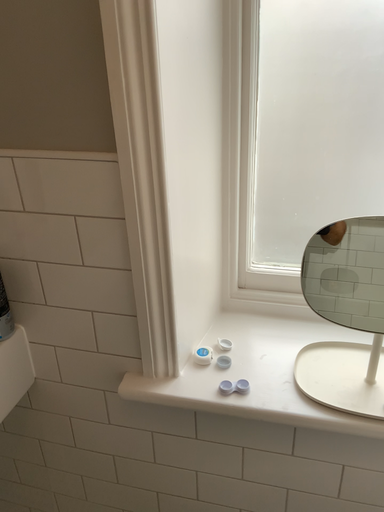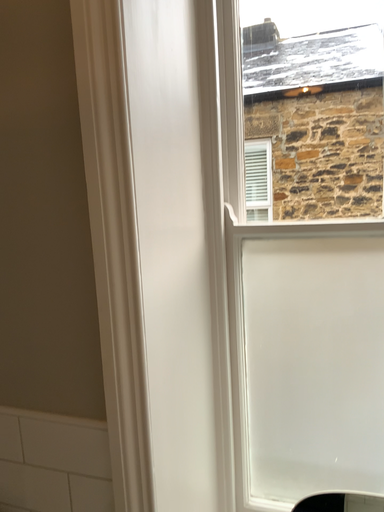
Question: How did the camera likely rotate when shooting the video?

Choices:
 (A) rotated downward
 (B) rotated upward

Answer: (B)